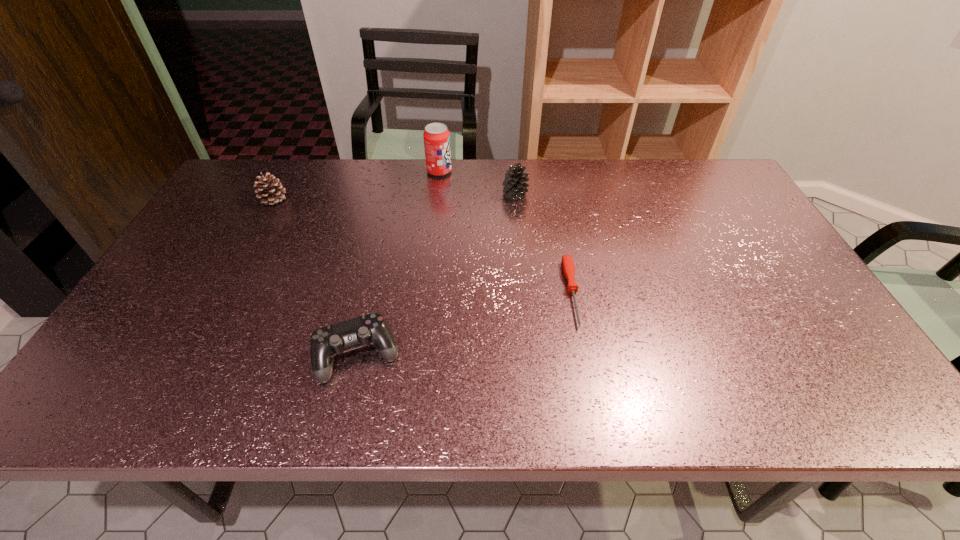
You are a GUI agent. You are given a task and a screenshot of the screen. Output one action in this format:
    pyautogui.click(x=<x>, y=<y>)
    Task: Click on the vacant space that is in between the soda can and the rightmost object
    The width and height of the screenshot is (960, 540).
    Given the screenshot: What is the action you would take?
    pyautogui.click(x=506, y=232)

The width and height of the screenshot is (960, 540). Identify the location of vacant region between the second shortest object and the right pinecone. (437, 274).

Find the location of a particular element. This screenshot has height=540, width=960. the fourth closest object to the farthest object is located at coordinates (325, 342).

This screenshot has width=960, height=540. In order to click on object that ranks as the closest to the control in this screenshot , I will do `click(567, 262)`.

At what (x,y) coordinates should I click in order to perform the action: click on free region that satisfies the following two spatial constraints: 1. on the surface of the fourth shortest object; 2. on the left side of the farthest object. Please return your answer as a coordinate pair (x, y). The height and width of the screenshot is (540, 960). Looking at the image, I should click on (437, 194).

The image size is (960, 540). Identify the location of free spot that satisfies the following two spatial constraints: 1. on the surface of the second tallest object; 2. on the right side of the soda can. (437, 194).

Locate an element on the screen. This screenshot has width=960, height=540. vacant space that satisfies the following two spatial constraints: 1. on the surface of the tallest object; 2. on the back side of the taller pinecone is located at coordinates click(437, 194).

The width and height of the screenshot is (960, 540). Identify the location of blank space that satisfies the following two spatial constraints: 1. on the surface of the second object from right to left; 2. on the right side of the farthest object. (437, 194).